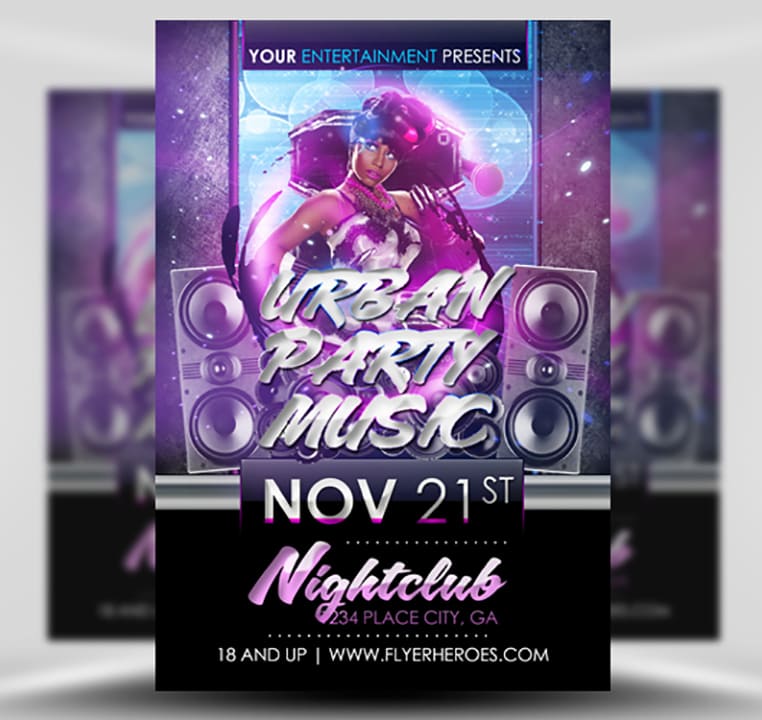
This screenshot has width=762, height=720. What are the coordinates of `speaker` in the screenshot? It's located at (242, 350), (514, 350).